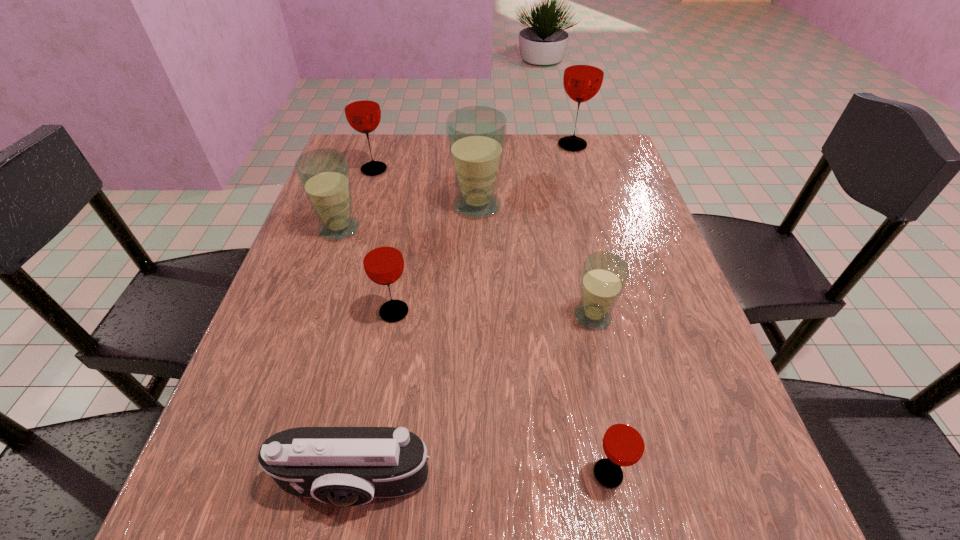
In the image, there is a desktop. Where is `vacant area at the far left corner`? The image size is (960, 540). vacant area at the far left corner is located at coordinates (393, 164).

I want to click on free spot between the nearest blue glass and the third red glass from right to left, so click(x=493, y=314).

Where is `free space between the second nearest red glass and the nearest red glass`? This screenshot has width=960, height=540. free space between the second nearest red glass and the nearest red glass is located at coordinates (501, 393).

You are a GUI agent. You are given a task and a screenshot of the screen. Output one action in this format:
    pyautogui.click(x=<x>, y=<y>)
    Task: Click on the vacant space in between the camera and the leftmost blue glass
    The height and width of the screenshot is (540, 960).
    Given the screenshot: What is the action you would take?
    pyautogui.click(x=348, y=357)

I want to click on free space between the camera and the smallest red glass, so click(x=481, y=480).

Locate an element on the screen. vacant area that lies between the leftmost blue glass and the third red glass from left to right is located at coordinates (474, 352).

Locate an element on the screen. The image size is (960, 540). free spot between the seventh nearest object and the second biggest blue glass is located at coordinates (357, 199).

At what (x,y) coordinates should I click in order to perform the action: click on vacant space that is in between the smallest red glass and the camera. Please return your answer as a coordinate pair (x, y). The width and height of the screenshot is (960, 540). Looking at the image, I should click on (481, 480).

I want to click on vacant space that's between the leftmost red glass and the leftmost blue glass, so click(357, 199).

The width and height of the screenshot is (960, 540). I want to click on object that is the seventh closest one to the fourth glass from right to left, so click(624, 442).